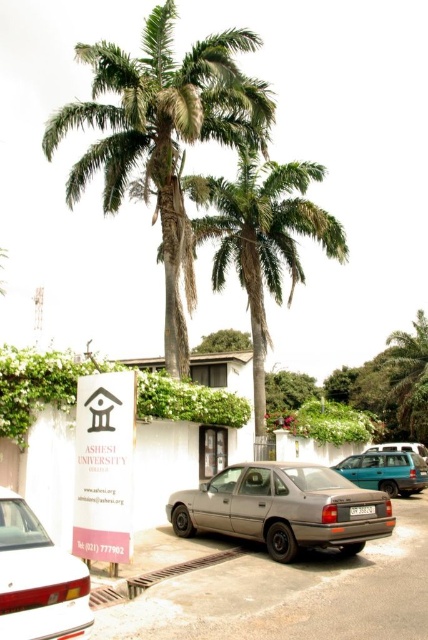
You are standing in front of the Ashesi University College signboard and notice two green leafy palm trees in the background. Which palm tree, the green leafy palm trees at upper center or the green leafy palm tree at center, is closer to you?

The green leafy palm trees at upper center is closer to you because it is in front of the green leafy palm tree at center.